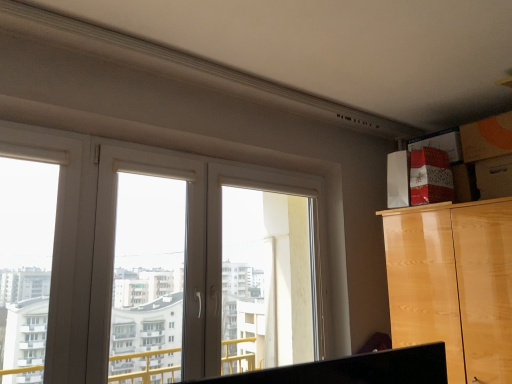
Question: From the image's perspective, is white plastic window at center, acting as the first window frame starting from the left, over glossy wood cabinet at upper right?

Choices:
 (A) no
 (B) yes

Answer: (B)

Question: Is white plastic window at center, which is the 2th window frame from right to left, at the right side of glossy wood cabinet at upper right?

Choices:
 (A) no
 (B) yes

Answer: (A)

Question: From the image's perspective, would you say white plastic window at center, which is the 2th window frame from right to left, is shown under glossy wood cabinet at upper right?

Choices:
 (A) yes
 (B) no

Answer: (B)

Question: Can you confirm if white plastic window at center, which is the 2th window frame from right to left, is thinner than glossy wood cabinet at upper right?

Choices:
 (A) yes
 (B) no

Answer: (A)

Question: Is white plastic window at center, acting as the first window frame starting from the left, positioned before glossy wood cabinet at upper right?

Choices:
 (A) yes
 (B) no

Answer: (A)

Question: In terms of height, does glossy wood cabinet at upper right look taller or shorter compared to white plastic window frame at center, which ranks as the 1th window frame in right-to-left order?

Choices:
 (A) tall
 (B) short

Answer: (B)

Question: Is glossy wood cabinet at upper right inside or outside of white plastic window frame at center, which ranks as the 1th window frame in right-to-left order?

Choices:
 (A) inside
 (B) outside

Answer: (B)

Question: In the image, is glossy wood cabinet at upper right on the left side or the right side of white plastic window frame at center, which ranks as the 1th window frame in right-to-left order?

Choices:
 (A) right
 (B) left

Answer: (A)

Question: Considering the positions of glossy wood cabinet at upper right and white plastic window frame at center, which ranks as the 1th window frame in right-to-left order, in the image, is glossy wood cabinet at upper right wider or thinner than white plastic window frame at center, which ranks as the 1th window frame in right-to-left order,?

Choices:
 (A) thin
 (B) wide

Answer: (B)

Question: From the image's perspective, is white plastic window at center, which is the 2th window frame from right to left, located above or below glossy wood cabinet at upper right?

Choices:
 (A) above
 (B) below

Answer: (A)

Question: Is white plastic window at center, which is the 2th window frame from right to left, to the left or to the right of glossy wood cabinet at upper right in the image?

Choices:
 (A) right
 (B) left

Answer: (B)

Question: Considering the positions of white plastic window at center, which is the 2th window frame from right to left, and glossy wood cabinet at upper right in the image, is white plastic window at center, which is the 2th window frame from right to left, bigger or smaller than glossy wood cabinet at upper right?

Choices:
 (A) big
 (B) small

Answer: (B)

Question: Is white plastic window at center, acting as the first window frame starting from the left, taller or shorter than glossy wood cabinet at upper right?

Choices:
 (A) short
 (B) tall

Answer: (B)

Question: From a real-world perspective, relative to white plastic window frame at center, which ranks as the 1th window frame in right-to-left order, is wooden drawer at upper right vertically above or below?

Choices:
 (A) below
 (B) above

Answer: (B)

Question: In terms of size, does wooden drawer at upper right appear bigger or smaller than white plastic window frame at center, which ranks as the 1th window frame in right-to-left order?

Choices:
 (A) big
 (B) small

Answer: (B)